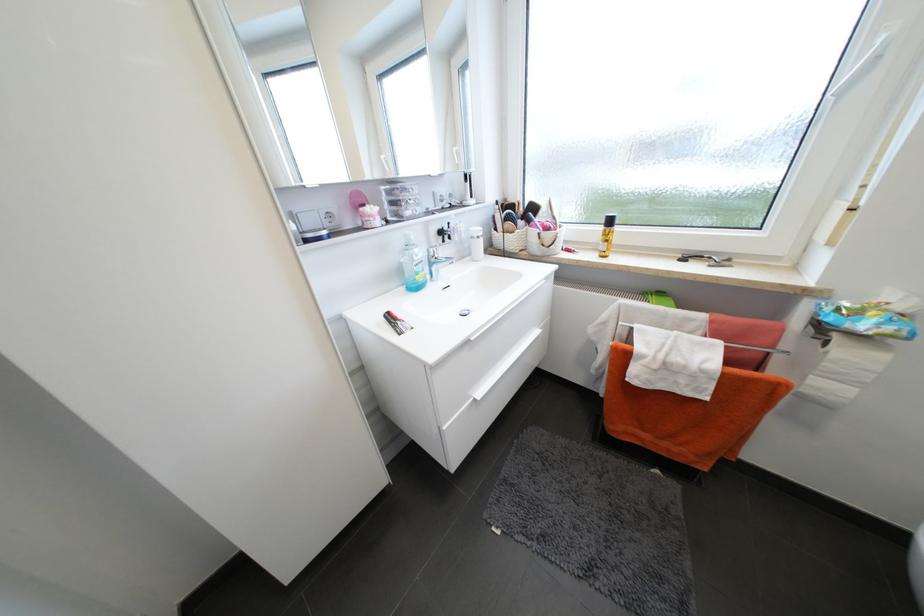
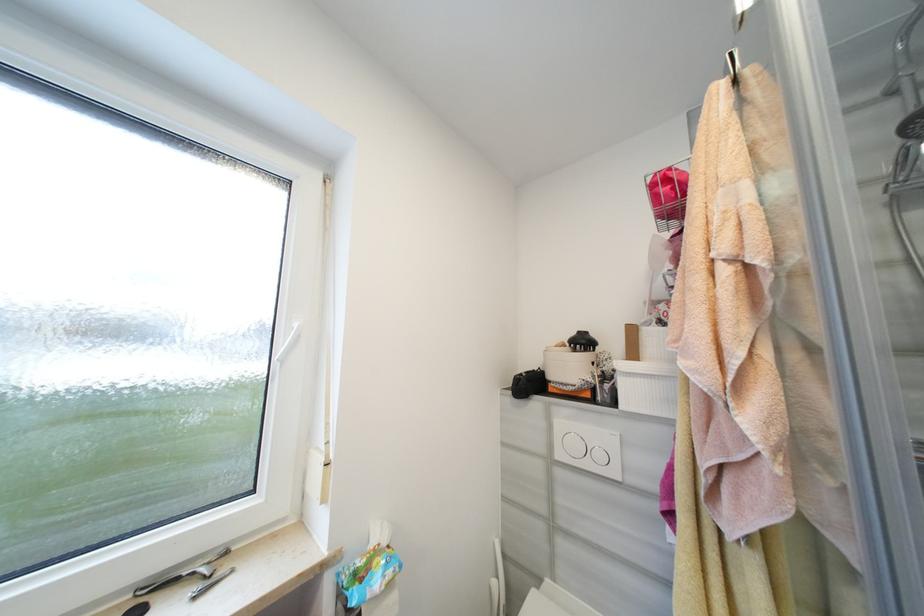
Question: The camera is either moving clockwise (left) or counter-clockwise (right) around the object. The first image is from the beginning of the video and the second image is from the end. Is the camera moving left or right when shooting the video?

Choices:
 (A) Left
 (B) Right

Answer: (A)